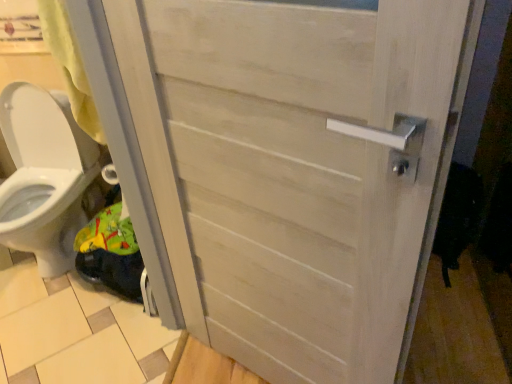
Locate an element on the screen. The image size is (512, 384). free space above beige wood tile at lower left (from a real-world perspective) is located at coordinates (77, 321).